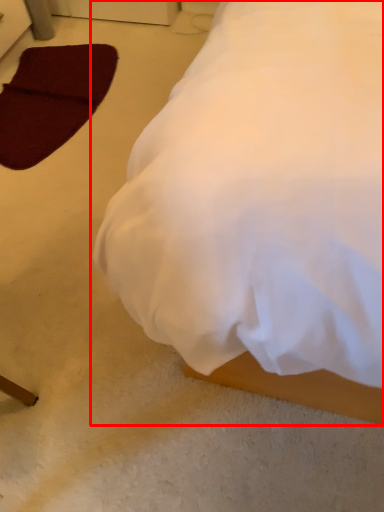
Question: From the image's perspective, considering the relative positions of bed (annotated by the red box) and pad in the image provided, where is bed (annotated by the red box) located with respect to the staircase?

Choices:
 (A) above
 (B) below

Answer: (B)